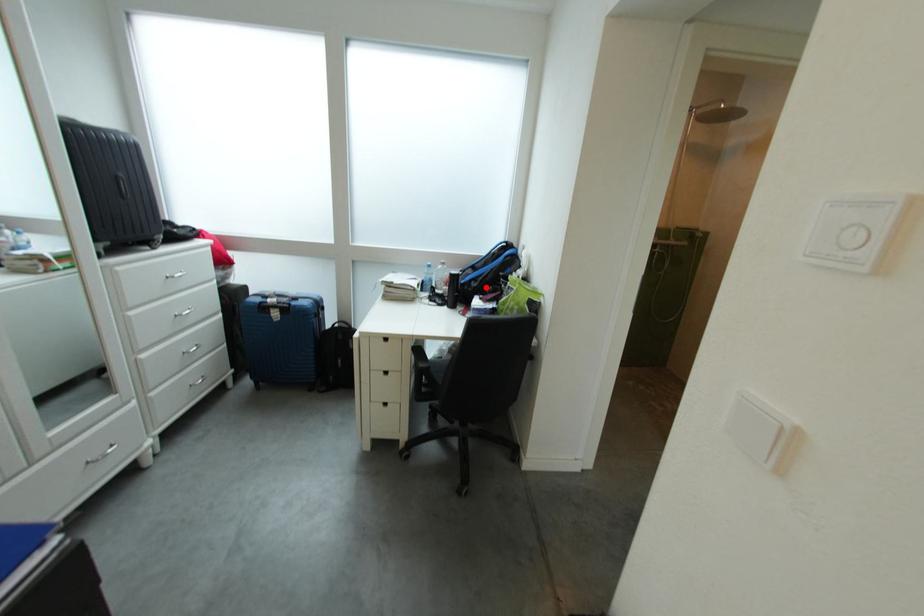
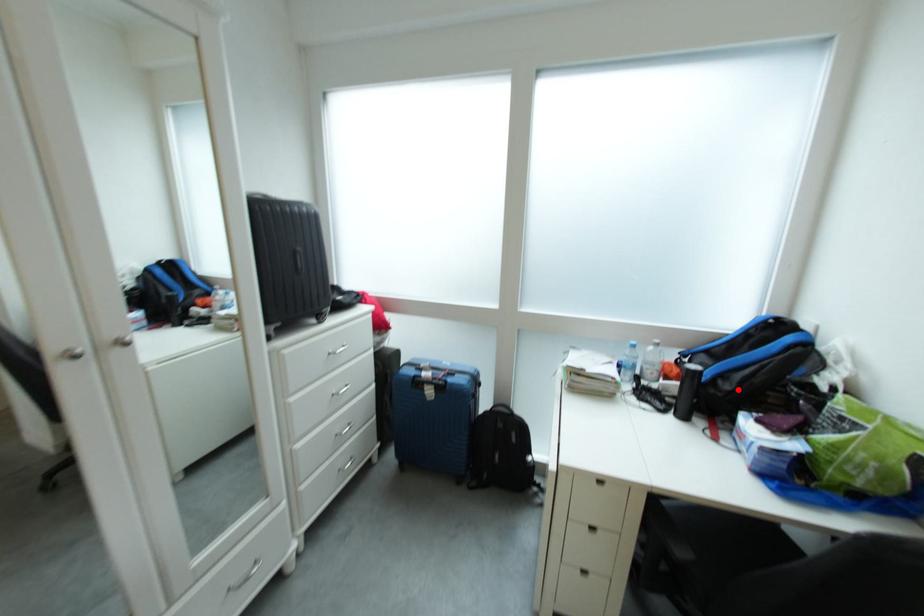
I am providing you with two images of the same scene from different viewpoints. A red point is marked on the first image and another point is marked on the second image. Do the highlighted points in image1 and image2 indicate the same real-world spot?

Yes